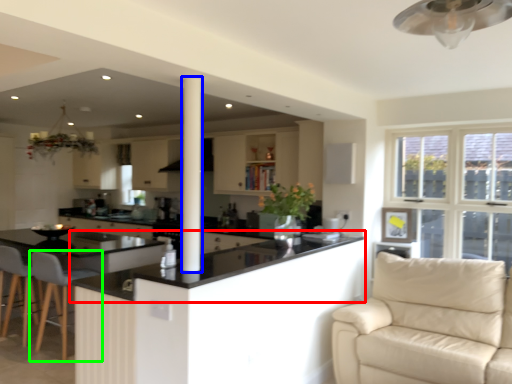
Question: Which is nearer to the countertop (highlighted by a red box)? pillar (highlighted by a blue box) or chair (highlighted by a green box).

Choices:
 (A) pillar
 (B) chair

Answer: (B)